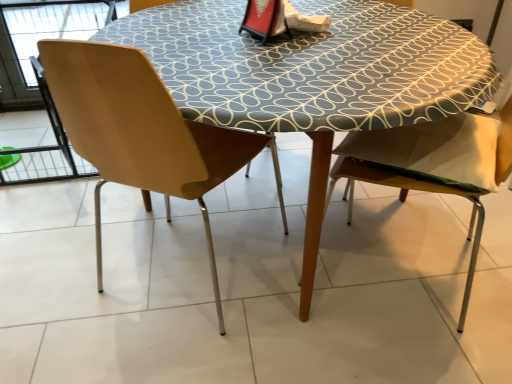
This screenshot has height=384, width=512. Identify the location of vacant region in front of matte wood chair at left, arranged as the 1th chair when viewed from the left. (178, 344).